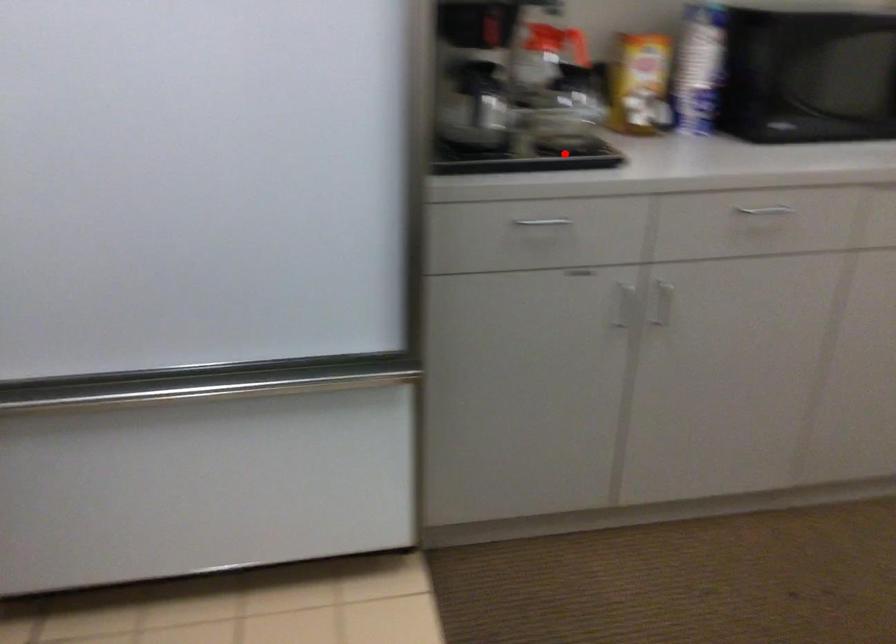
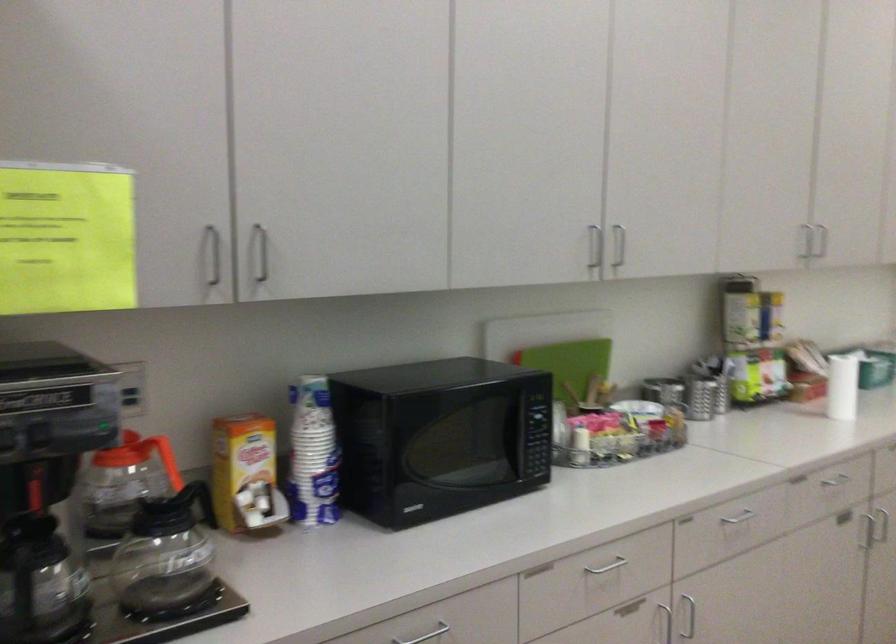
Where in the second image is the point corresponding to the highlighted location from the first image?

(159, 619)